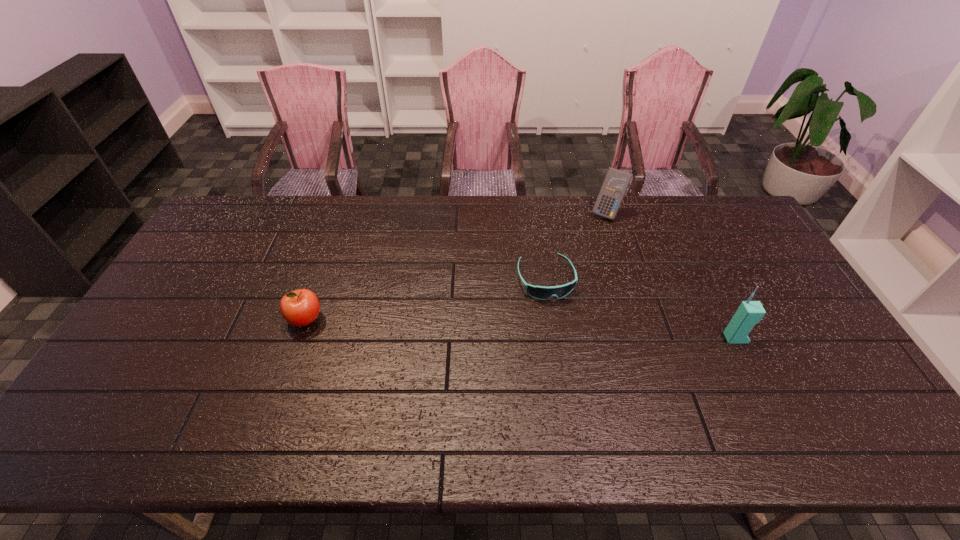
The width and height of the screenshot is (960, 540). I want to click on vacant space at the far left corner of the desktop, so click(x=259, y=205).

Locate an element on the screen. Image resolution: width=960 pixels, height=540 pixels. free space at the far right corner of the desktop is located at coordinates (718, 233).

Where is `vacant space at the near right corner`? The image size is (960, 540). vacant space at the near right corner is located at coordinates (855, 402).

Where is `free spot between the sunglasses and the second shortest object`? The width and height of the screenshot is (960, 540). free spot between the sunglasses and the second shortest object is located at coordinates (425, 299).

Identify the location of vacant space that's between the rightmost object and the second object from left to right. The height and width of the screenshot is (540, 960). (640, 309).

In order to click on unoccupied position between the leftmost object and the third object from left to right in this screenshot , I will do `click(456, 266)`.

You are a GUI agent. You are given a task and a screenshot of the screen. Output one action in this format:
    pyautogui.click(x=<x>, y=<y>)
    Task: Click on the free area in between the third shortest object and the third object from right to left
    This screenshot has width=960, height=540.
    Given the screenshot: What is the action you would take?
    pyautogui.click(x=576, y=246)

Find the location of a particular element. The height and width of the screenshot is (540, 960). vacant area that lies between the third tallest object and the cellular telephone is located at coordinates (520, 329).

This screenshot has width=960, height=540. What are the coordinates of `vacant area that lies between the cellular telephone and the apple` in the screenshot? It's located at (520, 329).

Identify the location of vacant region between the calculator and the apple. (456, 266).